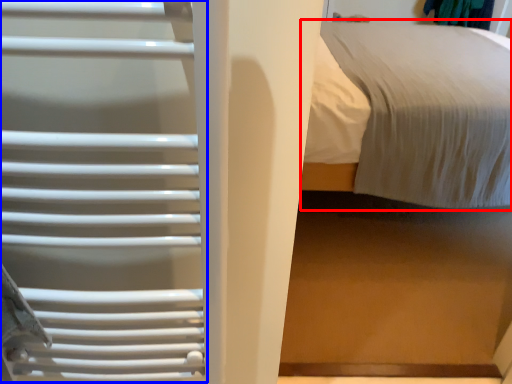
Question: Which object appears closest to the camera in this image, bed (highlighted by a red box) or cage (highlighted by a blue box)?

Choices:
 (A) bed
 (B) cage

Answer: (B)